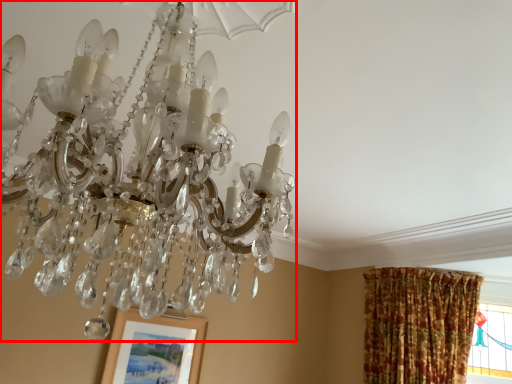
Question: Observing the image, what is the correct spatial positioning of lamp (annotated by the red box) in reference to picture frame?

Choices:
 (A) left
 (B) right

Answer: (B)